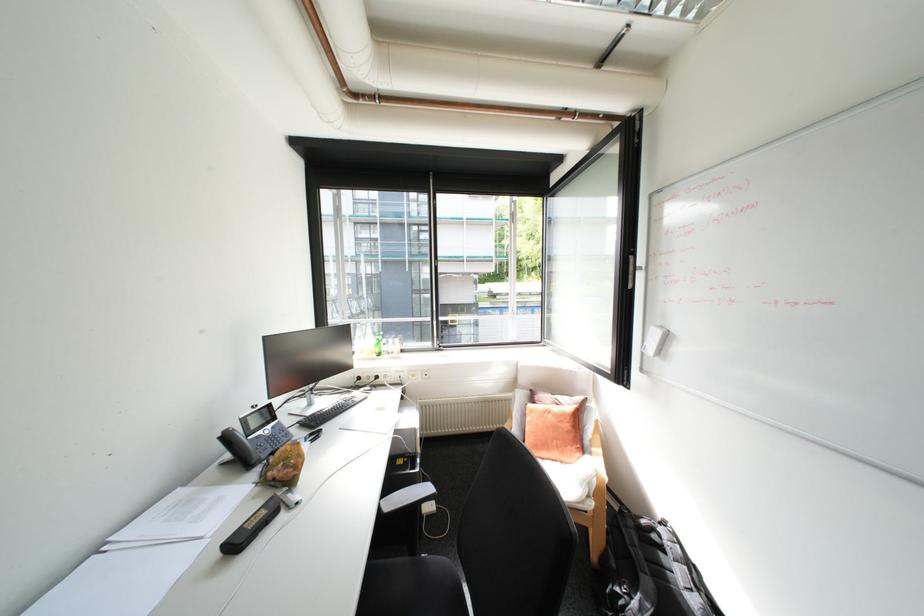
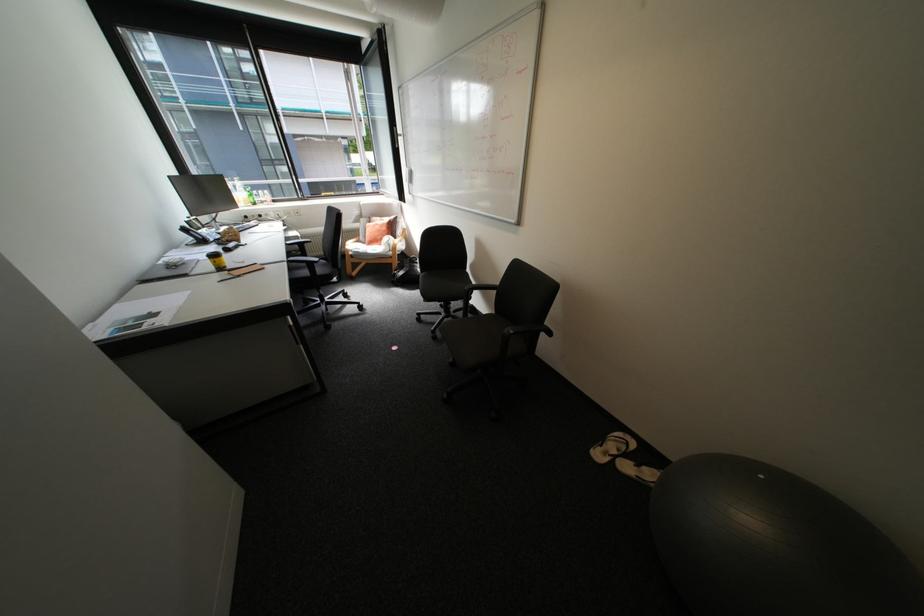
In the second image, find the point that corresponds to point (237, 437) in the first image.

(195, 230)